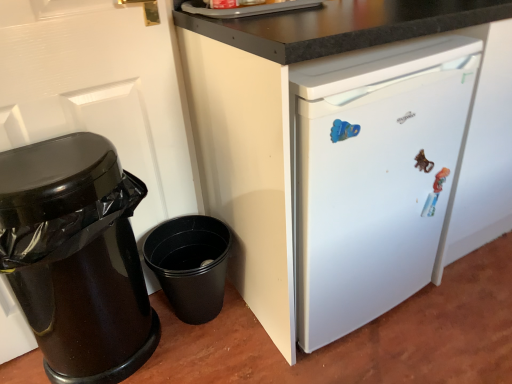
Question: From a real-world perspective, is white matte refrigerator at center physically located above or below white glossy door at left?

Choices:
 (A) above
 (B) below

Answer: (B)

Question: From their relative heights in the image, would you say white matte refrigerator at center is taller or shorter than white glossy door at left?

Choices:
 (A) tall
 (B) short

Answer: (B)

Question: Considering the real-world distances, which object is closest to the white glossy door at left?

Choices:
 (A) white matte refrigerator at center
 (B) black glossy trash can at left

Answer: (B)

Question: Considering the real-world distances, which object is farthest from the black glossy trash can at left?

Choices:
 (A) white matte refrigerator at center
 (B) white glossy door at left

Answer: (A)